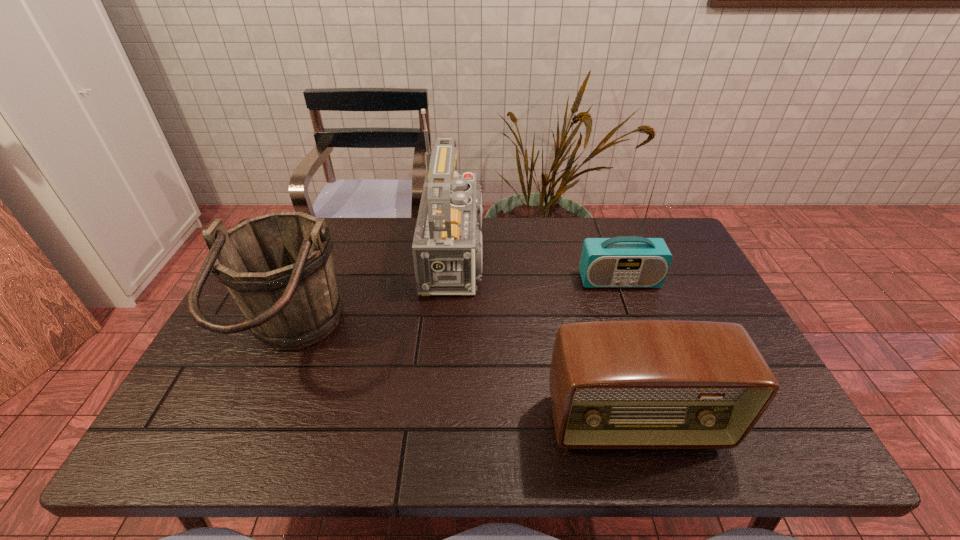
Identify the location of free spot between the leftmost object and the shortest radio receiver. (464, 381).

Locate an element on the screen. This screenshot has width=960, height=540. free area in between the second tallest radio receiver and the leftmost object is located at coordinates (455, 309).

Where is `free space between the second object from left to right and the second tallest radio receiver`? free space between the second object from left to right and the second tallest radio receiver is located at coordinates (541, 267).

I want to click on free space that is in between the shortest object and the leftmost object, so click(x=464, y=381).

The image size is (960, 540). I want to click on the closest object relative to the leftmost radio receiver, so (x=278, y=267).

Select which object is the third closest to the third object from right to left. Please provide its 2D coordinates. Your answer should be formatted as a tuple, i.e. [(x, y)], where the tuple contains the x and y coordinates of a point satisfying the conditions above.

[(636, 384)]

Select which radio receiver is the second closest to the second tallest radio receiver. Please provide its 2D coordinates. Your answer should be formatted as a tuple, i.e. [(x, y)], where the tuple contains the x and y coordinates of a point satisfying the conditions above.

[(636, 384)]

Locate which radio receiver ranks in proximity to the second shortest radio receiver. Please provide its 2D coordinates. Your answer should be formatted as a tuple, i.e. [(x, y)], where the tuple contains the x and y coordinates of a point satisfying the conditions above.

[(447, 247)]

This screenshot has width=960, height=540. Find the location of `vacant point that satisfies the following two spatial constraints: 1. on the front panel of the second shortest radio receiver; 2. on the handle side of the bucket`. vacant point that satisfies the following two spatial constraints: 1. on the front panel of the second shortest radio receiver; 2. on the handle side of the bucket is located at coordinates (640, 338).

You are a GUI agent. You are given a task and a screenshot of the screen. Output one action in this format:
    pyautogui.click(x=<x>, y=<y>)
    Task: Click on the free space that satisfies the following two spatial constraints: 1. on the front panel of the second tallest radio receiver; 2. on the handle side of the leftmost object
    The image size is (960, 540).
    Given the screenshot: What is the action you would take?
    pyautogui.click(x=640, y=338)